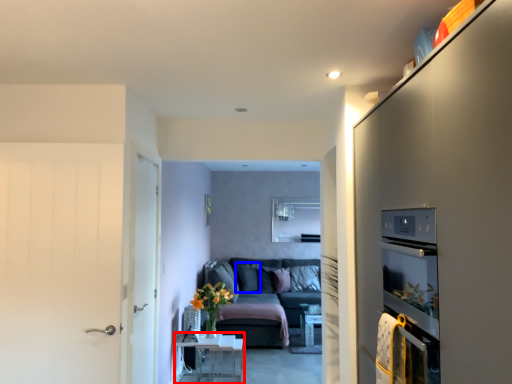
Question: Which object appears farthest to the camera in this image, table (highlighted by a red box) or pillow (highlighted by a blue box)?

Choices:
 (A) table
 (B) pillow

Answer: (B)